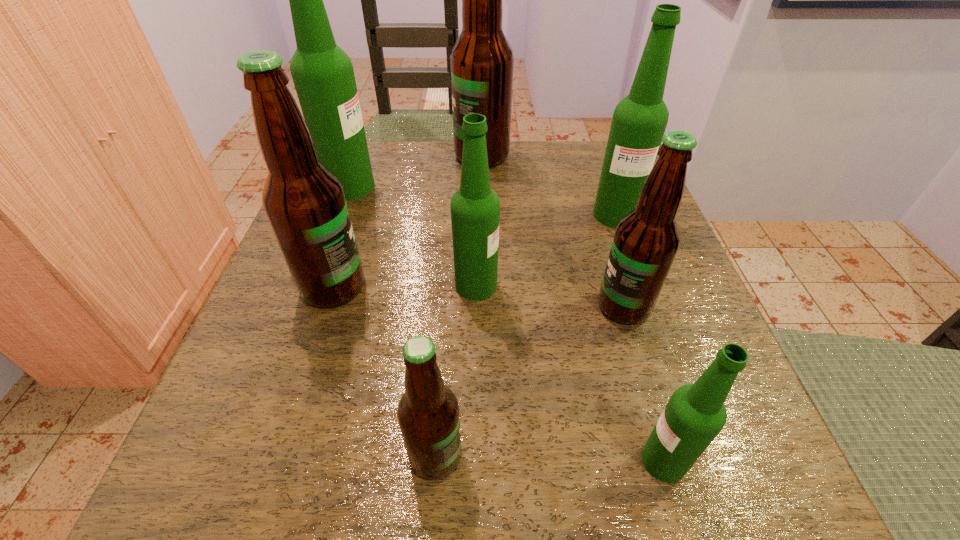
The image size is (960, 540). Find the location of `the third closest green beer bottle to the biggest green beer bottle`. the third closest green beer bottle to the biggest green beer bottle is located at coordinates (695, 414).

The image size is (960, 540). In order to click on green beer bottle that is the nearest to the second nearest green beer bottle in this screenshot , I will do `click(639, 121)`.

Locate an element on the screen. Image resolution: width=960 pixels, height=540 pixels. blank area in the image that satisfies the following two spatial constraints: 1. on the label of the third farthest object; 2. on the label of the third biggest brown beer bottle is located at coordinates (648, 306).

I want to click on free space in the image that satisfies the following two spatial constraints: 1. on the label of the third farthest beer bottle; 2. on the label of the smallest brown beer bottle, so click(x=701, y=456).